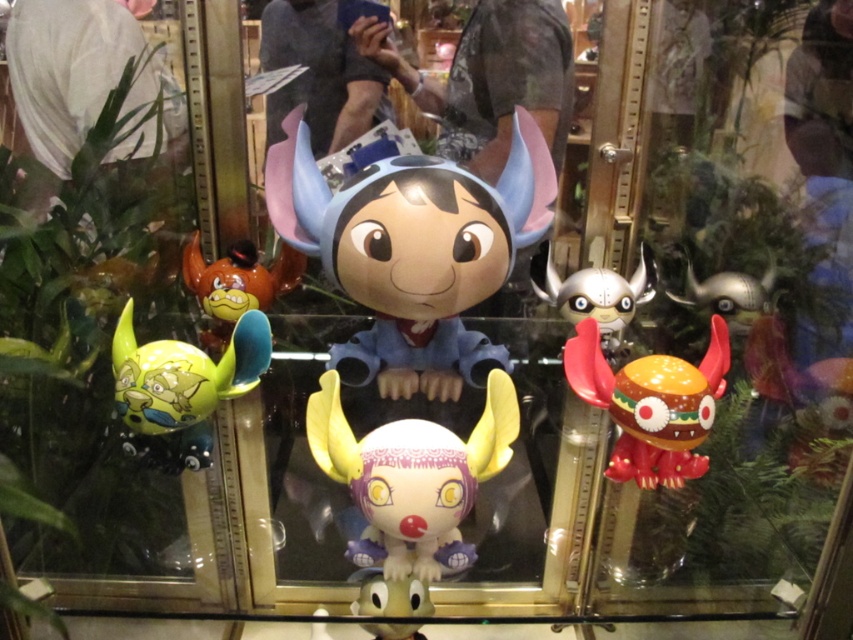
Which is in front, point (410, 477) or point (590, 285)?

Point (410, 477) is more forward.

Does white matte plush toy at center have a lesser width compared to silver metallic helmet at center?

Incorrect, white matte plush toy at center's width is not less than silver metallic helmet at center's.

Which is in front, point (415, 566) or point (614, 362)?

Point (415, 566) is in front.

Locate an element on the screen. white matte plush toy at center is located at coordinates (412, 477).

Which of these two, white matte plush toy at center or shiny yellow toy at left, stands taller?

Standing taller between the two is white matte plush toy at center.

You are a GUI agent. You are given a task and a screenshot of the screen. Output one action in this format:
    pyautogui.click(x=<x>, y=<y>)
    Task: Click on the white matte plush toy at center
    The height and width of the screenshot is (640, 853).
    Given the screenshot: What is the action you would take?
    pyautogui.click(x=412, y=477)

The width and height of the screenshot is (853, 640). I want to click on white matte plush toy at center, so click(412, 477).

From the picture: Can you confirm if shiny yellow toy at left is thinner than silver metallic helmet at center?

No, shiny yellow toy at left is not thinner than silver metallic helmet at center.

Between point (187, 364) and point (602, 349), which one is positioned in front?

Point (187, 364) is in front.

The width and height of the screenshot is (853, 640). Find the location of `shiny yellow toy at left`. shiny yellow toy at left is located at coordinates (183, 372).